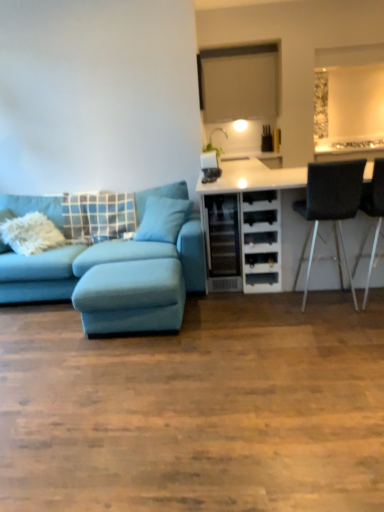
Find the location of a particular element. vacant area to the right of light blue fabric footrest at lower left is located at coordinates (228, 320).